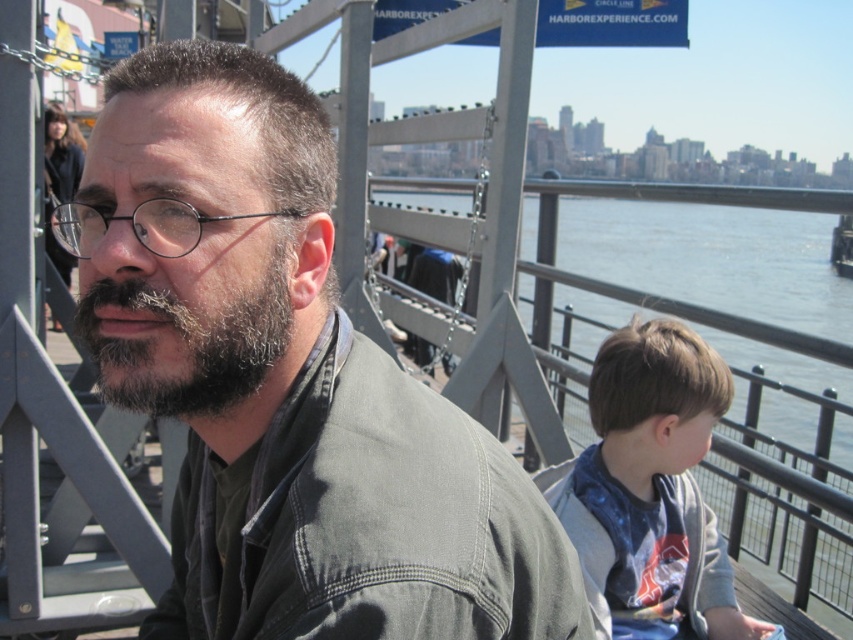
Question: Which point is closer to the camera taking this photo?

Choices:
 (A) (544, 204)
 (B) (264, 348)
 (C) (689, 394)
 (D) (161, 122)

Answer: (D)

Question: Which of the following is the closest to the observer?

Choices:
 (A) matte gray jacket at center
 (B) dark brown fuzzy beard at center

Answer: (A)

Question: Is blue water at center wider than dark brown fuzzy beard at center?

Choices:
 (A) no
 (B) yes

Answer: (B)

Question: Is matte gray jacket at center smaller than dark brown fuzzy beard at center?

Choices:
 (A) no
 (B) yes

Answer: (A)

Question: Which point appears farthest from the camera in this image?

Choices:
 (A) (392, 548)
 (B) (235, 378)
 (C) (749, 282)

Answer: (C)

Question: From the image, what is the correct spatial relationship of light brown hair at right in relation to dark brown fuzzy beard at center?

Choices:
 (A) left
 (B) right

Answer: (B)